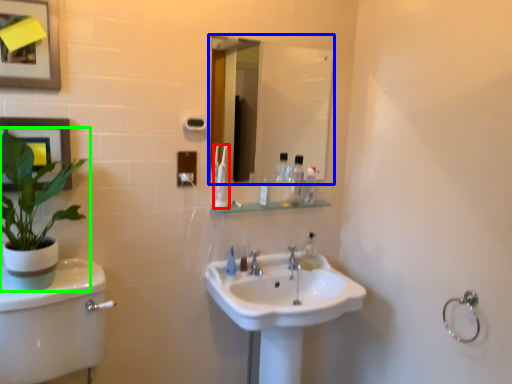
Question: Considering the real-world distances, which object is farthest from toothbrush (highlighted by a red box)? mirror (highlighted by a blue box) or houseplant (highlighted by a green box)?

Choices:
 (A) mirror
 (B) houseplant

Answer: (A)